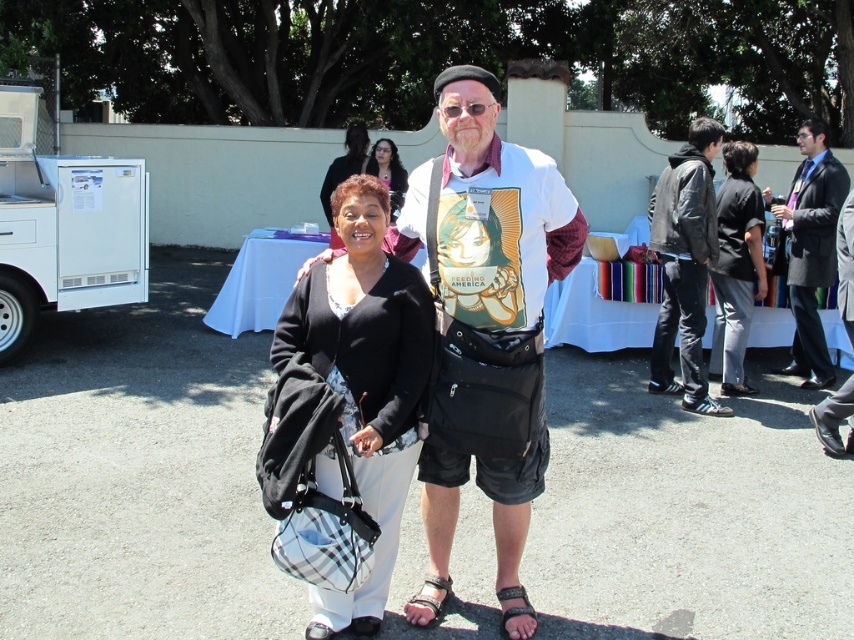
Question: Does matte black hair at upper center appear under leather sandal at lower center?

Choices:
 (A) no
 (B) yes

Answer: (A)

Question: Among these objects, which one is nearest to the camera?

Choices:
 (A) white plastic food truck at left
 (B) matte black t-shirt at center
 (C) black leather jacket at right
 (D) leather sandal at lower center

Answer: (B)

Question: Is black leather jacket at right positioned behind matte black hair at upper center?

Choices:
 (A) no
 (B) yes

Answer: (A)

Question: Which object is farther from the camera taking this photo?

Choices:
 (A) black leather jacket at center
 (B) black fabric purse at center

Answer: (A)

Question: Observing the image, what is the correct spatial positioning of black cotton shirt at center in reference to matte black hair at upper center?

Choices:
 (A) above
 (B) below

Answer: (B)

Question: Considering the real-world distances, which object is farthest from the matte black hair at upper center?

Choices:
 (A) black leather sandal at lower center
 (B) leather sandal at lower center

Answer: (A)